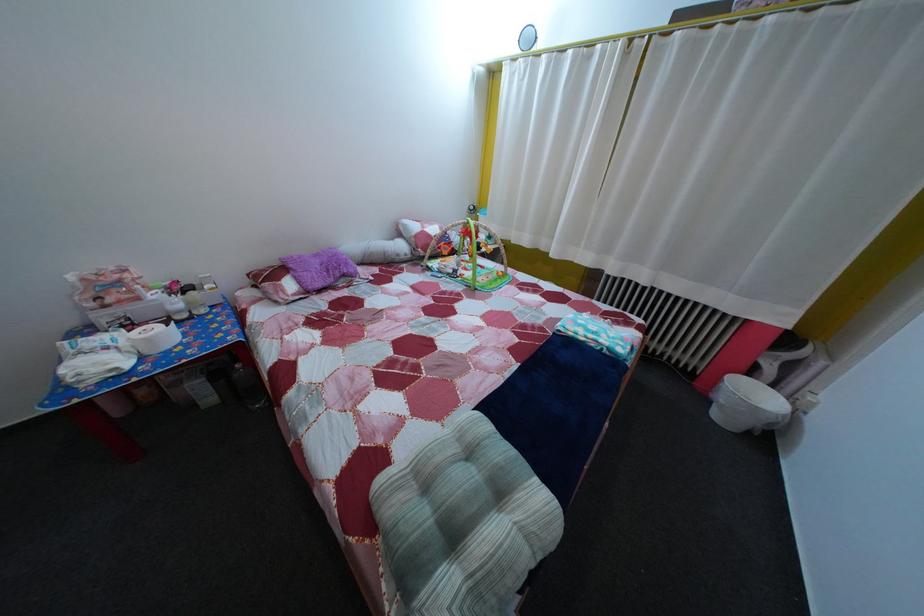
Where would you lift the roll of paper towels? Please return your answer as a coordinate pair (x, y).

(154, 338)